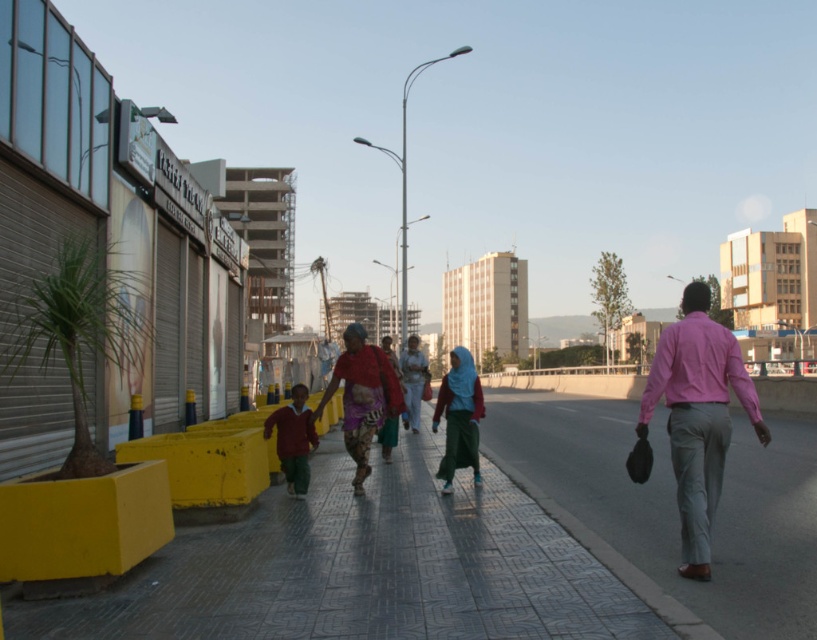
You are a fashion designer observing a model wearing a matte green skirt at center and a maroon fabric shirt at center. Which clothing item is positioned higher on the model?

The matte green skirt at center is above the maroon fabric shirt at center, so the matte green skirt at center is positioned higher on the model.

You are standing on the sidewalk looking at the urban street scene. There are two points marked in the image, one at coordinate point (565, 502) and the other at point (443, 474). Which point is closer to your current position?

Point (565, 502) is closer to your current position because it is closer to the camera than point (443, 474).

You are a pedestrian standing on the smooth concrete pavement at center. You want to reach the matte green skirt at center. Is the path directly above or below the skirt accessible to you?

The smooth concrete pavement at center is below the matte green skirt at center, so the path directly above the skirt is not accessible to you. The accessible path is below the skirt.